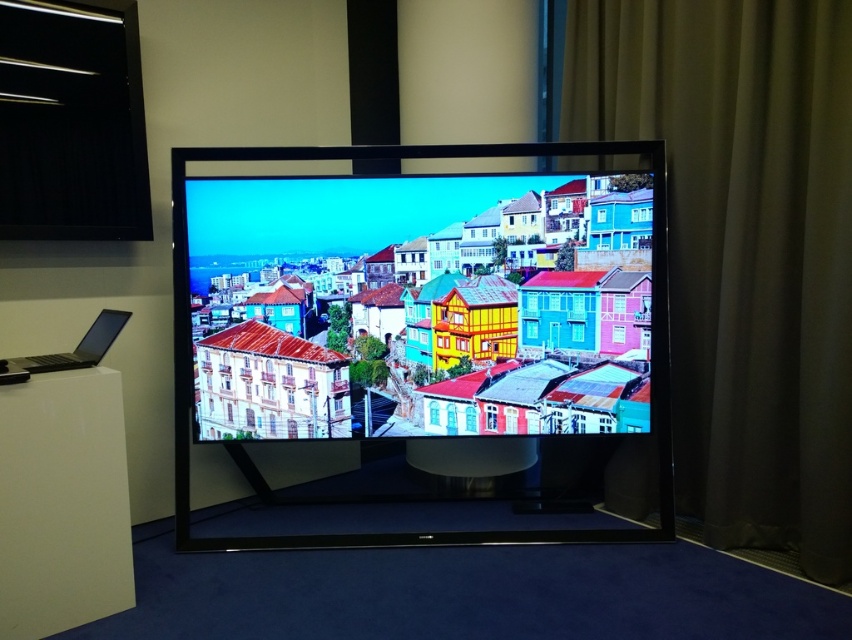
You are setting up a home theater system and need to place a 34 inch long cable between the matte glass screen at center and the satin black laptop at lower left. Will the cable be long enough to connect them without needing an extension?

The distance between the matte glass screen at center and the satin black laptop at lower left is 34.53 inches. Since the cable is 34 inches long, it is slightly shorter than the required distance. Therefore, the cable will not be long enough and an extension may be needed.

You are standing 1.7 meters tall and want to see the entire displayed image on the television screen. The point at point (734, 483) is the bottom edge of the screen. Can you see the top of the displayed image if you stand at this point?

The point at point (734, 483) is the bottom edge of the screen. Since you are 1.7 meters tall and the bottom edge is at 0.863 meters, you can see the entire displayed image, including the top, as your height exceeds the screen bottom edge height.

You are standing in front of a large flat screen TV and want to clean it. The cleaning spray you have requires you to hold it 3 meters away from the screen to avoid damaging it. Can you safely spray the matte glass screen at center from your current position?

The matte glass screen at center is 2.86 meters from the camera, which is less than the required 3 meters. Therefore, spraying from this distance may damage the screen. Move back to ensure you are at least 3 meters away before using the spray.